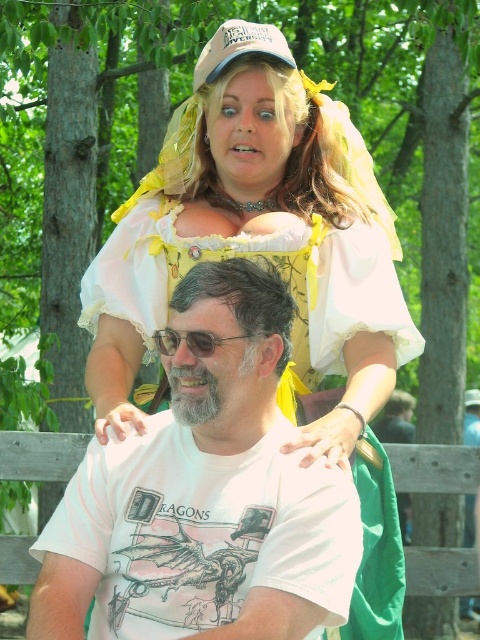
The width and height of the screenshot is (480, 640). Describe the element at coordinates (204, 497) in the screenshot. I see `white t-shirt at center` at that location.

Between point (196, 632) and point (191, 337), which one is positioned behind?

The point (191, 337) is more distant.

Which is behind, point (108, 458) or point (195, 340)?

Positioned behind is point (108, 458).

Find the location of a particular element. white t-shirt at center is located at coordinates (204, 497).

Locate an element on the screen. The image size is (480, 640). white lace dress at upper center is located at coordinates (282, 273).

Is white lace dress at upper center smaller than white mesh baseball cap at upper center?

No.

Between point (348, 125) and point (264, 33), which one is positioned in front?

Positioned in front is point (264, 33).

What are the coordinates of `white lace dress at upper center` in the screenshot? It's located at (282, 273).

Is point (288, 116) positioned before point (243, 580)?

No.

How distant is white lace dress at upper center from white t-shirt at center?

white lace dress at upper center is 40.48 centimeters away from white t-shirt at center.

Between point (155, 301) and point (126, 588), which one is positioned behind?

The point (155, 301) is more distant.

In order to click on white lace dress at upper center in this screenshot , I will do `click(282, 273)`.